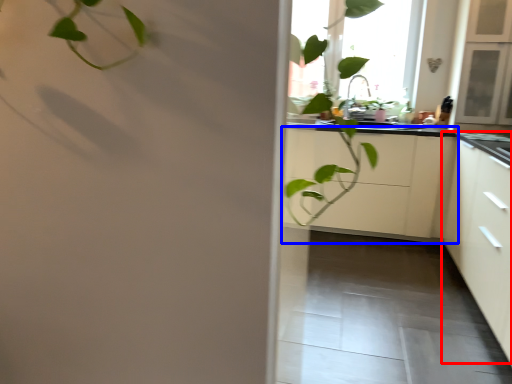
Question: Which point is further to the camera, cabinetry (highlighted by a red box) or cabinetry (highlighted by a blue box)?

Choices:
 (A) cabinetry
 (B) cabinetry

Answer: (B)